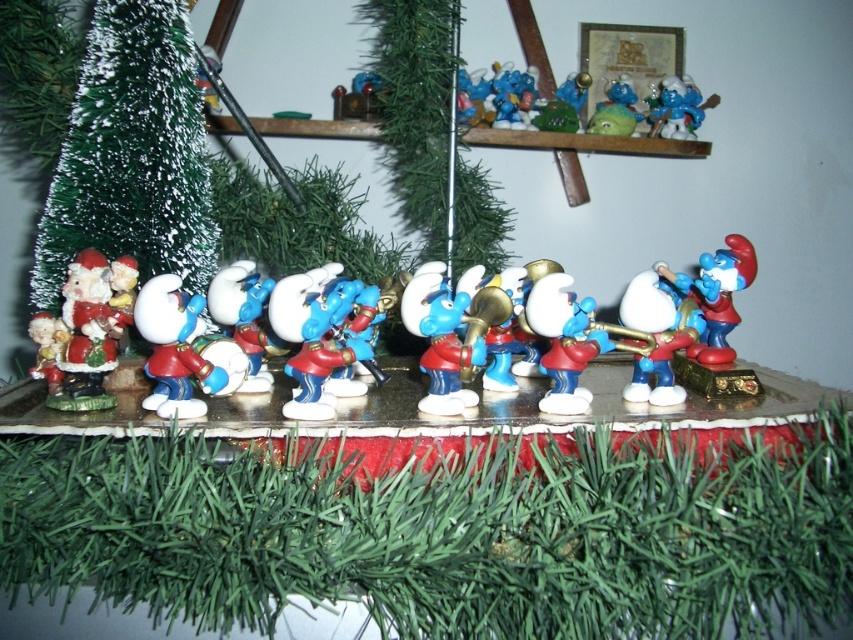
You are setting up a holiday display and want to know if the matte plastic santa at left can fit in the space currently occupied by the green matte christmas tree at upper center. Based on their sizes, what would you advise?

The matte plastic santa at left occupies less space than the green matte christmas tree at upper center, so it can fit in the space currently occupied by the green matte christmas tree at upper center.

You are a child trying to reach the blue glossy trumpet at center and the green matte christmas tree at upper center on a shelf. Which object is closer to you so you can grab it first?

The green matte christmas tree at upper center is closer to you than the blue glossy trumpet at center, so you can grab it first.

You are setting up a holiday display and want to place a small gift box between the green matte christmas tree at upper center and the blue glossy trumpet at center. The gift box is 28 centimeters long. Will it fit between them?

The distance between the green matte christmas tree at upper center and the blue glossy trumpet at center is 57.89 centimeters. Since the gift box is 28 centimeters long, it will fit comfortably between them with space to spare.